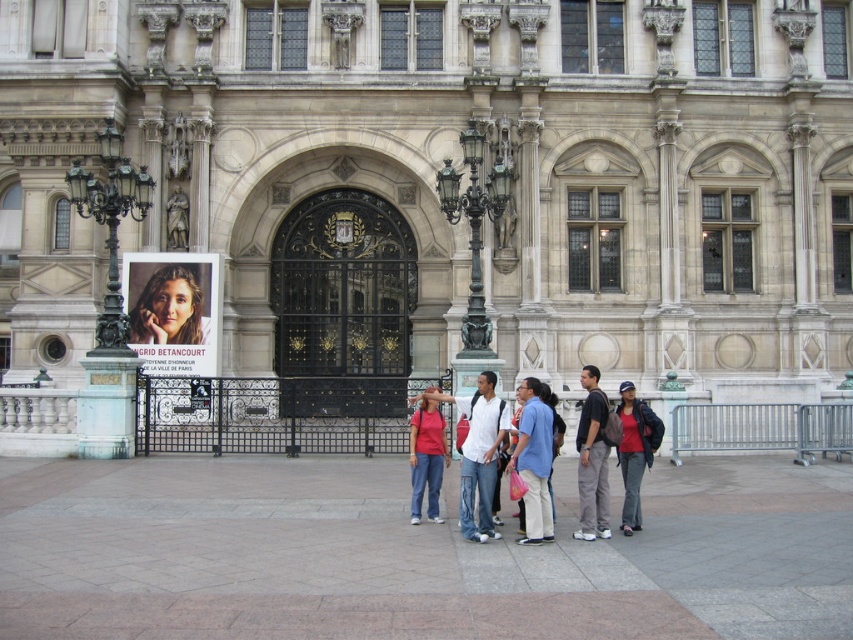
Question: Which object appears closest to the camera in this image?

Choices:
 (A) stone building at center
 (B) light blue shirt at center
 (C) matte pink shirt at center

Answer: (C)

Question: Is stone building at center below blue cotton shirt at center?

Choices:
 (A) yes
 (B) no

Answer: (B)

Question: Is stone building at center smaller than matte red t-shirt at center?

Choices:
 (A) no
 (B) yes

Answer: (A)

Question: Which object is farther from the camera taking this photo?

Choices:
 (A) blue cotton shirt at center
 (B) matte red t-shirt at center
 (C) dark gray pants at center
 (D) matte pink shirt at center

Answer: (B)

Question: Based on their relative distances, which object is farther from the matte pink shirt at center?

Choices:
 (A) matte red t-shirt at center
 (B) stone building at center
 (C) light blue shirt at center

Answer: (B)

Question: Is matte red t-shirt at center above light blue shirt at center?

Choices:
 (A) yes
 (B) no

Answer: (B)